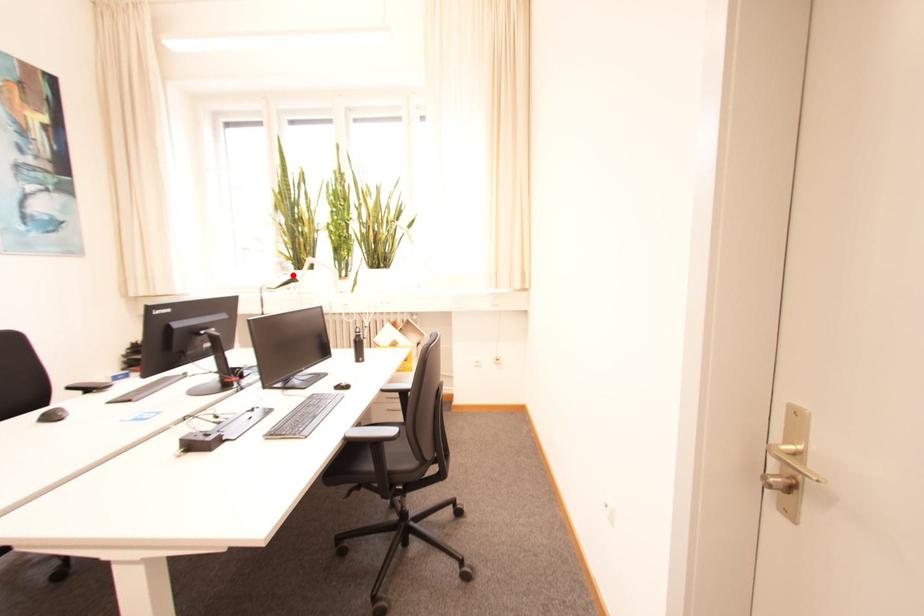
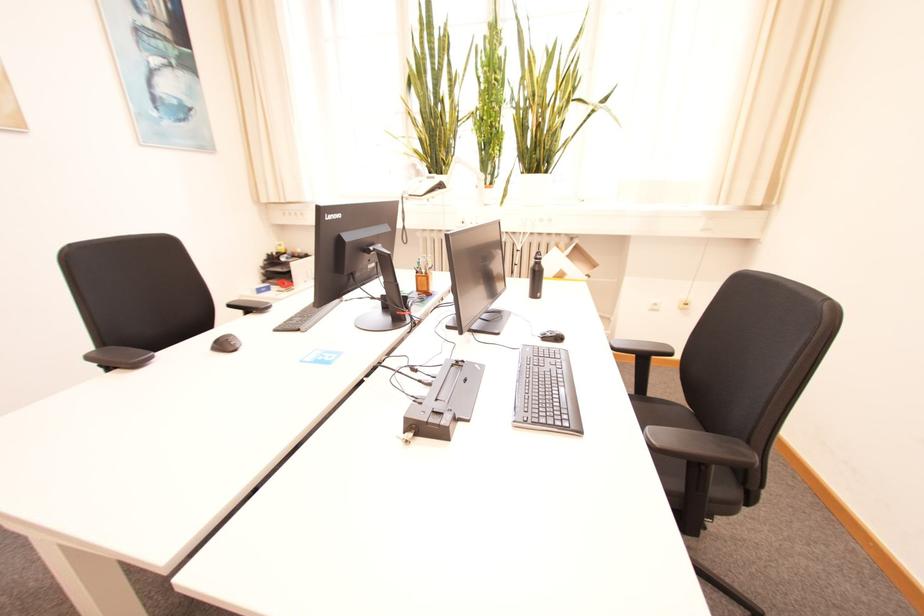
Question: A red point is marked in image1. In image2, is the corresponding 3D point closer to the camera or farther? Reply with the corresponding letter.

Choices:
 (A) The corresponding 3D point is closer.
 (B) The corresponding 3D point is farther.

Answer: (A)